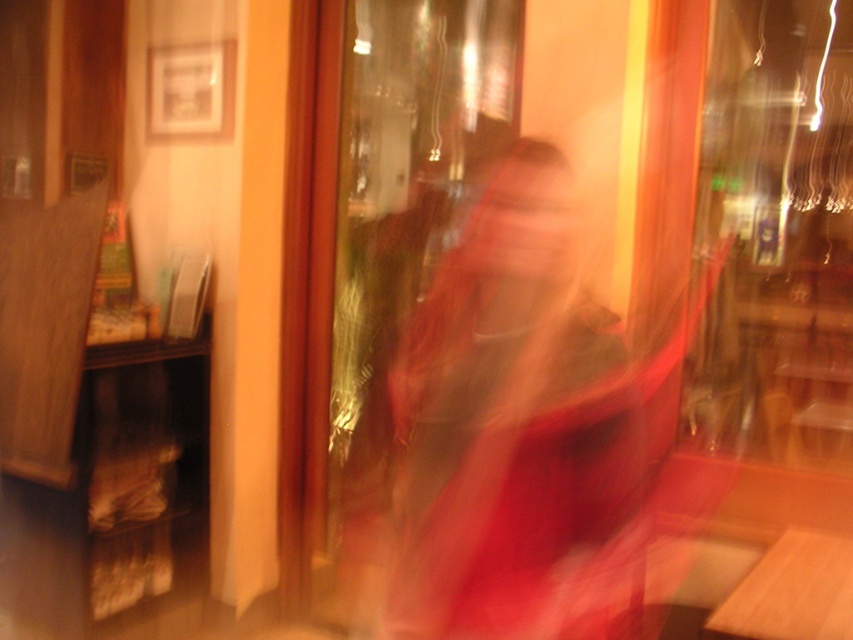
You are a delivery person who needs to enter the establishment through either the transparent glass shop window at upper right or the transparent glass door at center. Which entrance is more appropriate for delivering a package?

The transparent glass door at center is the appropriate entrance for delivering a package since the transparent glass shop window at upper right is located above it, likely being a window rather than an accessible entry point.

You are a delivery person who needs to hand over a package to the store inside. The transparent glass shop window at upper right and the transparent glass door at center are both in your view. Which one should you approach to enter the store?

You should approach the transparent glass door at center because the transparent glass shop window at upper right occupies less space and is likely not an entrance, while the transparent glass door at center is larger and more likely to be the entrance for delivering the package.